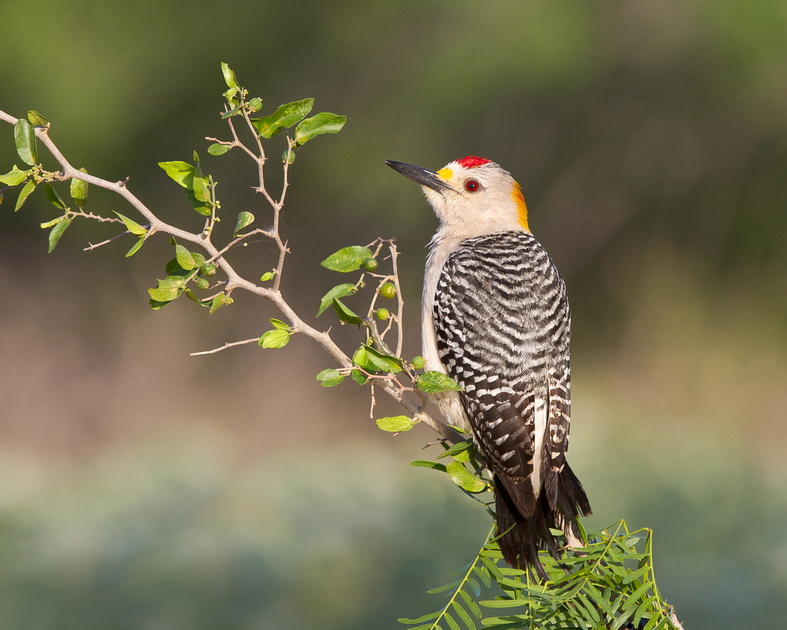
Locate an element on the screen. yellowish green plant stems is located at coordinates (457, 610), (501, 598), (643, 605), (593, 570).